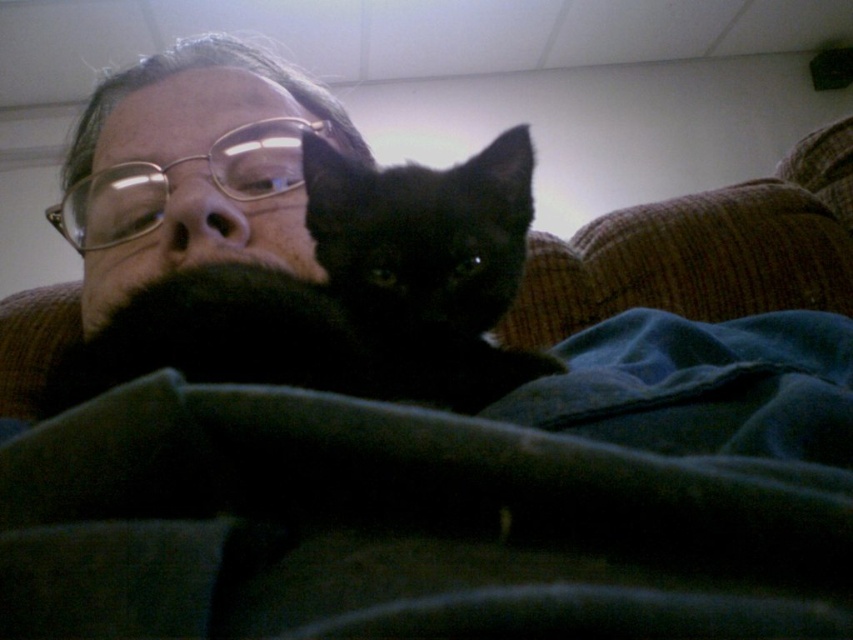
You are taking a photo of the scene. You want to focus on the point that is closer to the camera. Which point should you choose between point (492, 390) and point (90, 259)?

Point (492, 390) is closer to the camera than point (90, 259), so you should focus on point (492, 390).

You are designing a photo frame that needs to fit both the matte black beard at center and the brown corduroy couch at upper right. Which object requires a wider frame to accommodate its width?

The brown corduroy couch at upper right requires a wider frame because its width is greater than the matte black beard at center.